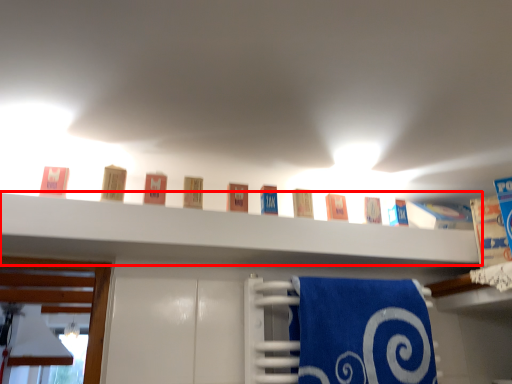
Question: Considering the relative positions of shelf (annotated by the red box) and bath towel in the image provided, where is shelf (annotated by the red box) located with respect to the staircase?

Choices:
 (A) left
 (B) right

Answer: (A)